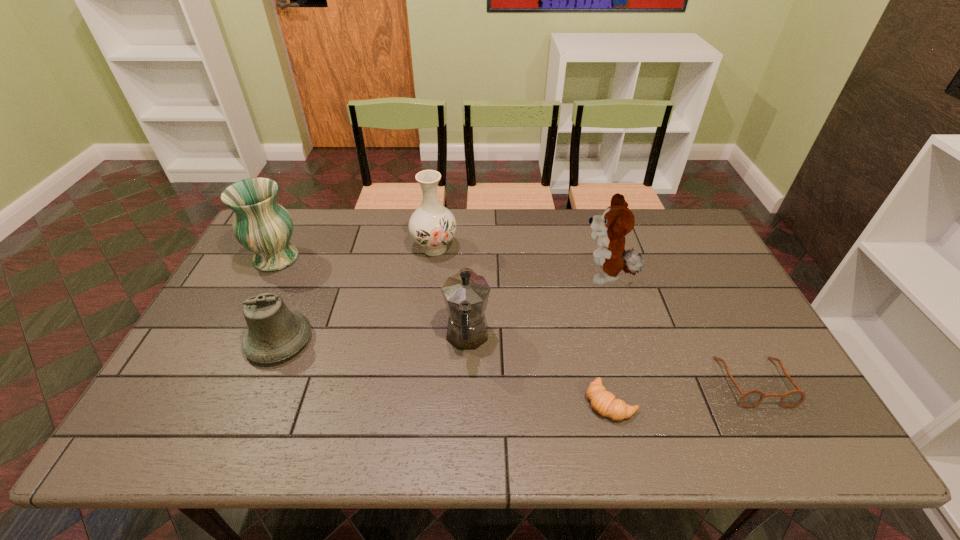
Find the location of a particular element. The height and width of the screenshot is (540, 960). free space that satisfies the following two spatial constraints: 1. on the front side of the crescent roll; 2. on the right side of the left vase is located at coordinates (202, 402).